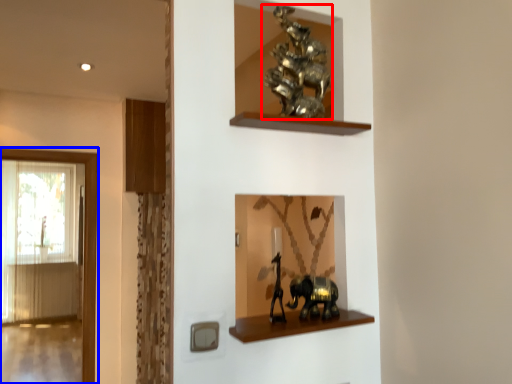
Question: Which object appears closest to the camera in this image, animal (highlighted by a red box) or window (highlighted by a blue box)?

Choices:
 (A) animal
 (B) window

Answer: (A)